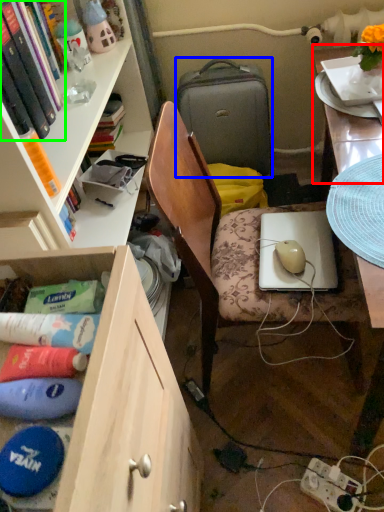
Question: Which is nearer to the table top (highlighted by a red box)? suitcase (highlighted by a blue box) or book (highlighted by a green box).

Choices:
 (A) suitcase
 (B) book

Answer: (A)